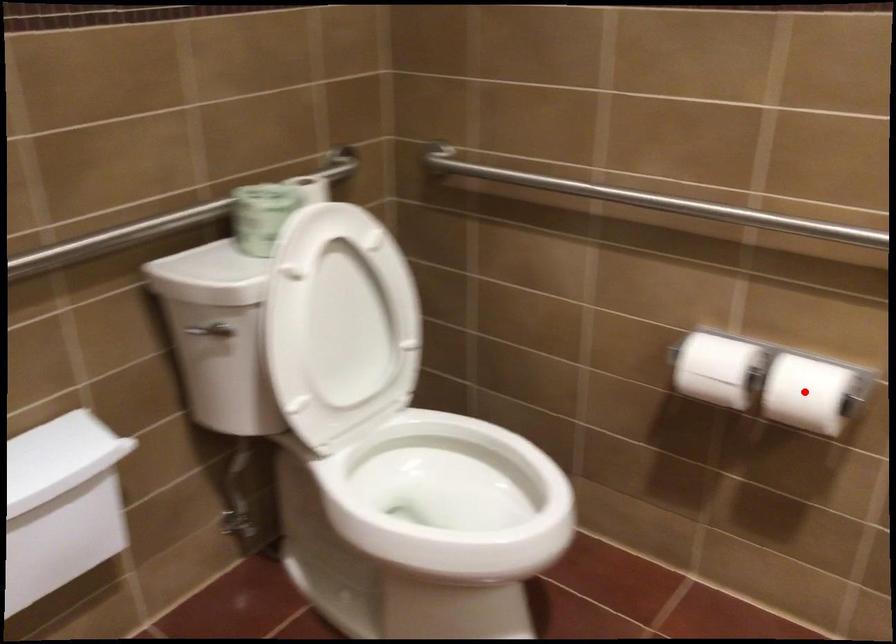
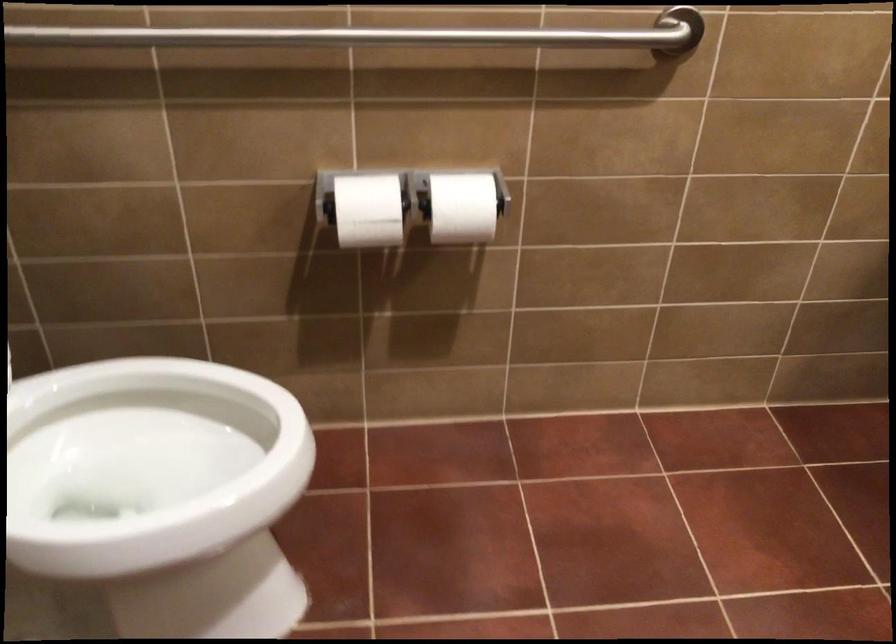
Locate, in the second image, the point that corresponds to the highlighted location in the first image.

(462, 207)